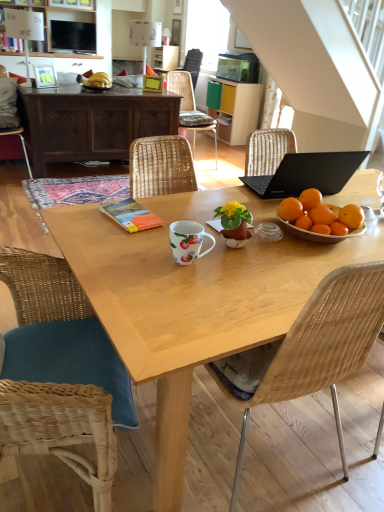
Question: Considering the positions of dark wood cabinet at upper left, which is counted as the second desk, starting from the front, and matte wood cabinet at upper left, the first cabinetry from the left, in the image, is dark wood cabinet at upper left, which is counted as the second desk, starting from the front, wider or thinner than matte wood cabinet at upper left, the first cabinetry from the left,?

Choices:
 (A) thin
 (B) wide

Answer: (B)

Question: Do you think dark wood cabinet at upper left, marked as the first desk in a back-to-front arrangement, is within matte wood cabinet at upper left, placed as the second cabinetry when sorted from bottom to top, or outside of it?

Choices:
 (A) inside
 (B) outside

Answer: (B)

Question: Which is farther from the wooden wicker chair at lower left, which is counted as the 2th chair, starting from the back?

Choices:
 (A) orange matte book at center
 (B) dark wood cabinet at upper left, the first desk when ordered from top to bottom
 (C) wooden woven chair at center, which appears as the second chair when viewed from the right
 (D) wooden table at center, which is counted as the second desk, starting from the back
 (E) matte wood cabinet at center, the first cabinetry in the bottom-to-top sequence

Answer: (D)

Question: Which object is the closest to the woven wood chair at center, positioned as the fourth chair in left-to-right order?

Choices:
 (A) woven wood chair at lower left, marked as the second chair in a left-to-right arrangement
 (B) matte gold picture frame at center, which ranks as the third picture frame in back-to-front order
 (C) matte wood cabinet at center, the 1th cabinetry when ordered from right to left
 (D) matte black tv at upper left
 (E) wooden table at center, acting as the 2th desk starting from the top

Answer: (E)